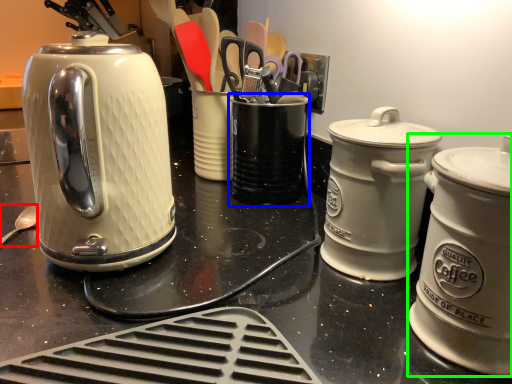
Question: Estimate the real-world distances between objects in this image. Which object is closer to spoon (highlighted by a red box), appliance (highlighted by a blue box) or kitchen appliance (highlighted by a green box)?

Choices:
 (A) appliance
 (B) kitchen appliance

Answer: (A)